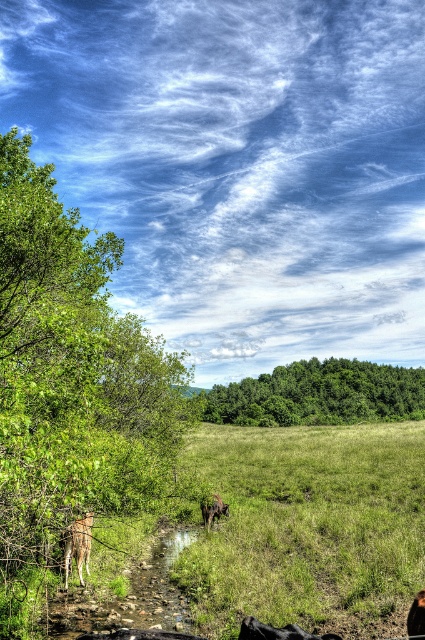
Question: Which point is farther to the camera?

Choices:
 (A) brown furry cow at center
 (B) green leafy trees at center
 (C) green leafy tree at left

Answer: (B)

Question: Can you confirm if brown fur deer at left is positioned below brown furry dog at lower right?

Choices:
 (A) no
 (B) yes

Answer: (B)

Question: Is brown fur deer at left further to camera compared to shiny black dog at lower right?

Choices:
 (A) no
 (B) yes

Answer: (B)

Question: Based on their relative distances, which object is nearer to the brown furry dog at lower right?

Choices:
 (A) green leafy tree at left
 (B) green leafy trees at center

Answer: (A)

Question: Is shiny black dog at lower right bigger than brown furry cow at center?

Choices:
 (A) no
 (B) yes

Answer: (A)

Question: Which object is farther from the camera taking this photo?

Choices:
 (A) green leafy tree at left
 (B) brown furry cow at center
 (C) green leafy trees at center

Answer: (C)